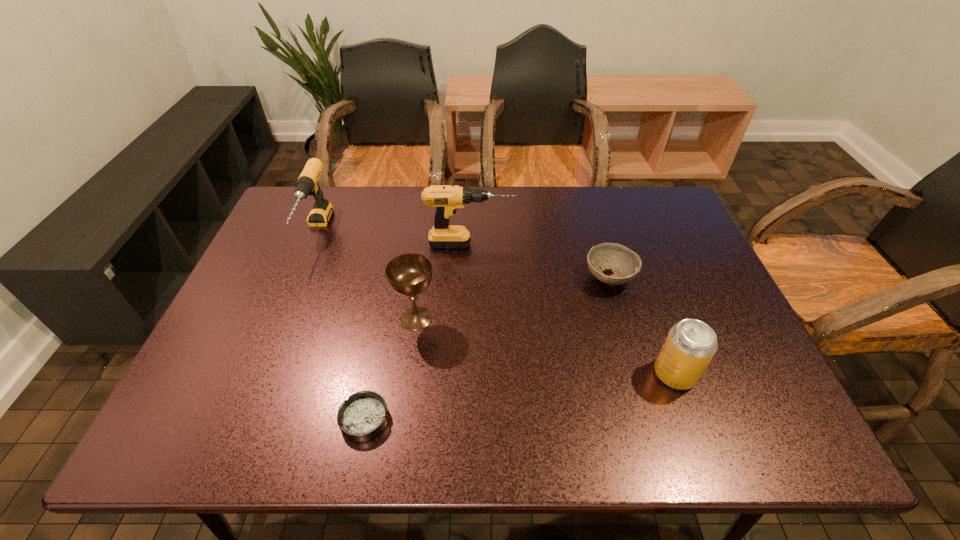
In order to click on free space that satisfies the following two spatial constraints: 1. on the handle side of the left drill; 2. on the left side of the second nearest object in this screenshot , I will do `click(257, 374)`.

You are a GUI agent. You are given a task and a screenshot of the screen. Output one action in this format:
    pyautogui.click(x=<x>, y=<y>)
    Task: Click on the free point that satisfies the following two spatial constraints: 1. at the tip of the right drill; 2. on the front side of the nearest object
    This screenshot has width=960, height=540.
    Given the screenshot: What is the action you would take?
    pyautogui.click(x=467, y=419)

The image size is (960, 540). Identify the location of vacant space that satisfies the following two spatial constraints: 1. at the tip of the right drill; 2. on the back side of the bowl. (469, 278).